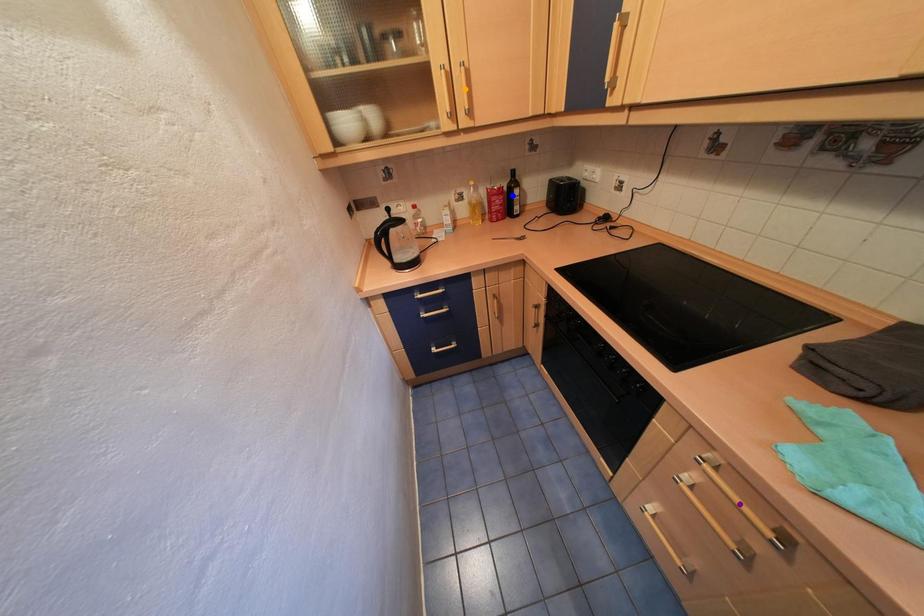
Order these from nearest to farthest:
purple point, blue point, orange point

blue point
orange point
purple point